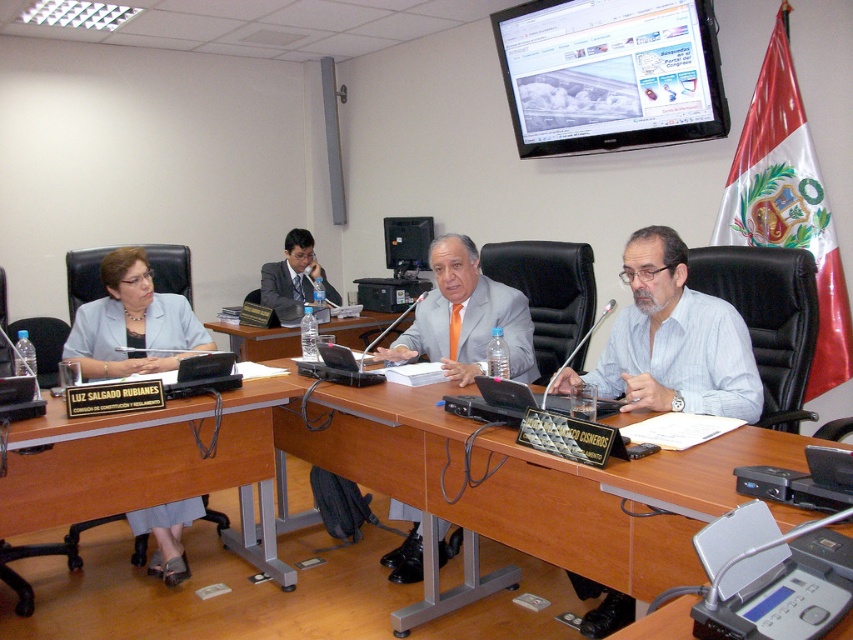
Question: Can you confirm if wooden table at center is positioned to the left of matte black suit at center?

Choices:
 (A) no
 (B) yes

Answer: (A)

Question: Among these points, which one is nearest to the camera?

Choices:
 (A) (433, 358)
 (B) (26, 424)

Answer: (B)

Question: Which object is the farthest from the wooden table at center?

Choices:
 (A) matte gray suit at left
 (B) brown wood table at lower left

Answer: (B)

Question: Is matte gray suit at center bigger than wooden table at center?

Choices:
 (A) yes
 (B) no

Answer: (B)

Question: Is brown wood table at center positioned in front of matte black suit at center?

Choices:
 (A) no
 (B) yes

Answer: (B)

Question: Which is nearer to the white shirt at center?

Choices:
 (A) matte black suit at center
 (B) matte gray suit at left
 (C) brown wood table at center
 (D) matte gray suit at center

Answer: (C)